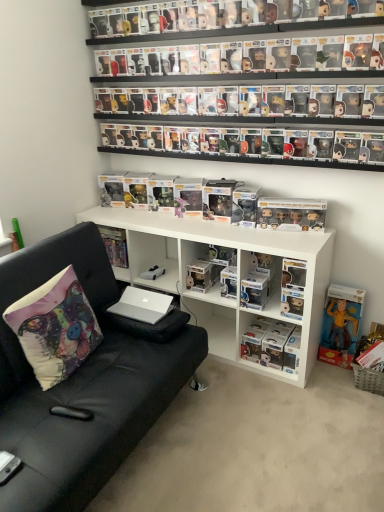
Question: Does white matte car at center, acting as the 3th toy starting from the right, come in front of yellow fabric figurine at lower right, which is counted as the first book, starting from the right?

Choices:
 (A) yes
 (B) no

Answer: (B)

Question: Would you say white matte car at center, acting as the 3th toy starting from the right, contains yellow fabric figurine at lower right, the third book positioned from the left?

Choices:
 (A) no
 (B) yes

Answer: (A)

Question: From the image's perspective, is white matte car at center, placed as the second toy when sorted from left to right, below yellow fabric figurine at lower right, the third book positioned from the left?

Choices:
 (A) no
 (B) yes

Answer: (A)

Question: Is white matte car at center, acting as the first toy starting from the bottom, facing towards yellow fabric figurine at lower right, the third book positioned from the left?

Choices:
 (A) yes
 (B) no

Answer: (B)

Question: Considering the relative positions of white matte car at center, which appears as the 4th toy when viewed from the top, and yellow fabric figurine at lower right, the third book positioned from the left, in the image provided, is white matte car at center, which appears as the 4th toy when viewed from the top, to the left of yellow fabric figurine at lower right, the third book positioned from the left, from the viewer's perspective?

Choices:
 (A) no
 (B) yes

Answer: (B)

Question: Is the surface of white matte car at center, acting as the first toy starting from the bottom, in direct contact with yellow fabric figurine at lower right, the third book positioned from the left?

Choices:
 (A) yes
 (B) no

Answer: (B)

Question: Is black plastic remote control at lower left positioned before silver metallic laptop at center?

Choices:
 (A) no
 (B) yes

Answer: (B)

Question: Does black plastic remote control at lower left turn towards silver metallic laptop at center?

Choices:
 (A) yes
 (B) no

Answer: (B)

Question: Is the surface of black plastic remote control at lower left in direct contact with silver metallic laptop at center?

Choices:
 (A) yes
 (B) no

Answer: (B)

Question: Is silver metallic laptop at center completely or partially inside black plastic remote control at lower left?

Choices:
 (A) no
 (B) yes

Answer: (A)

Question: Does black plastic remote control at lower left have a lesser height compared to silver metallic laptop at center?

Choices:
 (A) yes
 (B) no

Answer: (A)

Question: Is silver metallic laptop at center at the back of black plastic remote control at lower left?

Choices:
 (A) yes
 (B) no

Answer: (B)

Question: Is yellow fabric figurine at lower right, the third book positioned from the left, located outside clear plastic figure at center, the 2th book viewed from the left?

Choices:
 (A) yes
 (B) no

Answer: (A)